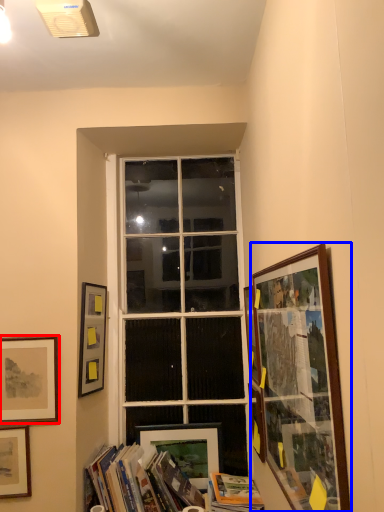
Question: Among these objects, which one is nearest to the camera, picture frame (highlighted by a red box) or picture frame (highlighted by a blue box)?

Choices:
 (A) picture frame
 (B) picture frame

Answer: (B)